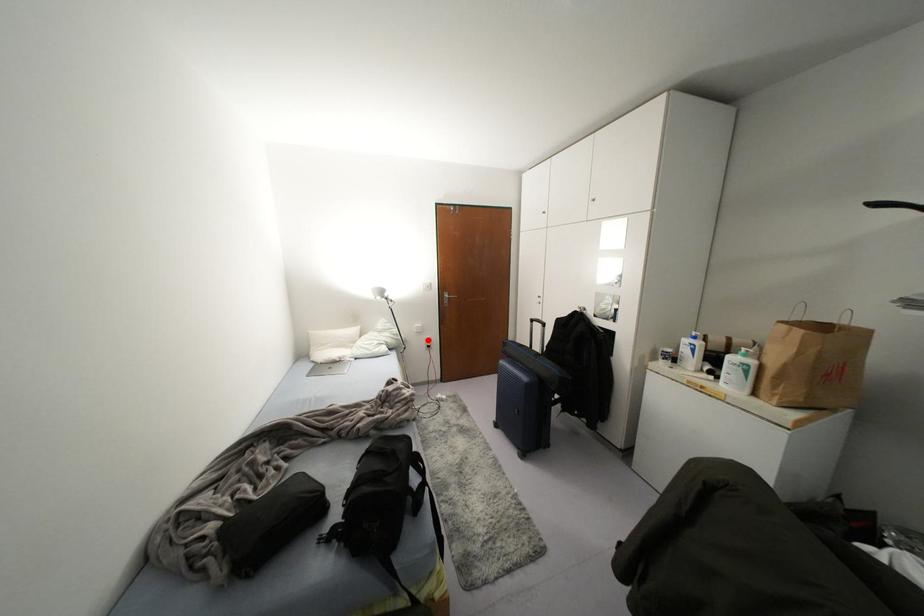
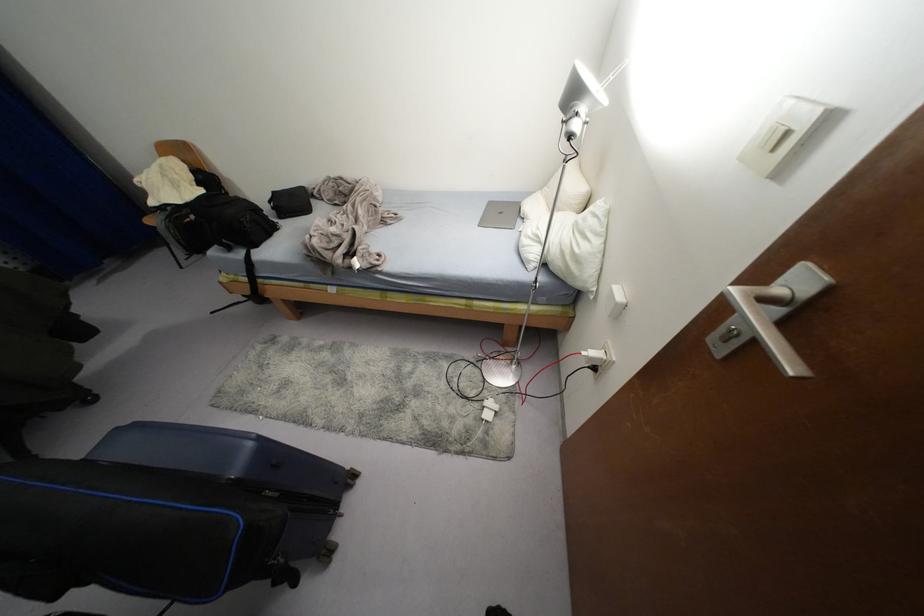
Question: I am providing you with two images of the same scene from different viewpoints. A red point is marked on the first image. Can you still see the location of the red point in image 2?

Choices:
 (A) Yes
 (B) No

Answer: (A)